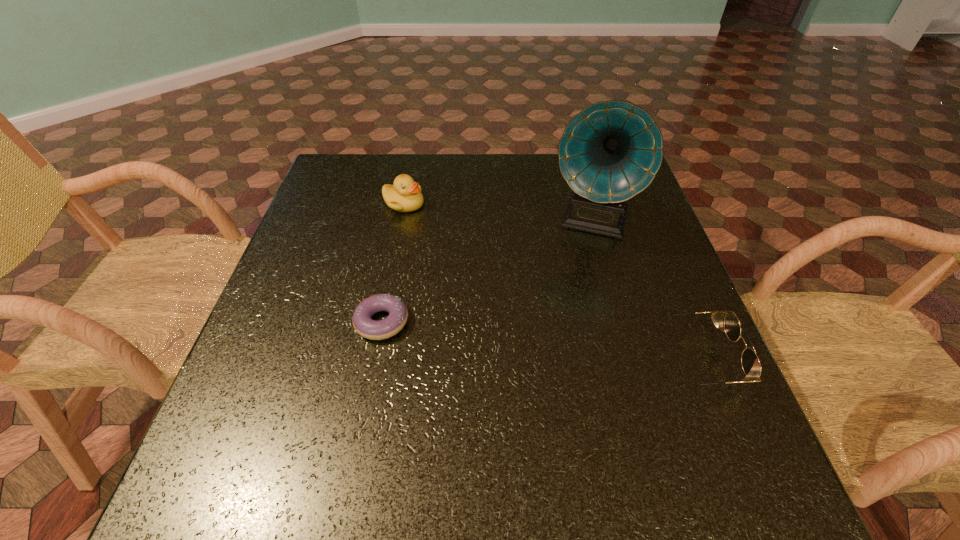
I want to click on vacant space located from the horn of the tallest object, so click(556, 358).

Where is `duckling that is at the far edge`? The image size is (960, 540). duckling that is at the far edge is located at coordinates (405, 195).

The height and width of the screenshot is (540, 960). In order to click on phonograph_record that is at the far edge in this screenshot , I will do click(x=611, y=151).

Locate an element on the screen. The height and width of the screenshot is (540, 960). object present at the near edge is located at coordinates (750, 362).

I want to click on sunglasses present at the right edge, so click(750, 362).

Find the location of a particular element. The image size is (960, 540). phonograph_record that is at the right edge is located at coordinates (611, 151).

Where is `object located at the far right corner`? The width and height of the screenshot is (960, 540). object located at the far right corner is located at coordinates (611, 151).

Identify the location of object that is positioned at the near right corner. The image size is (960, 540). (750, 362).

At what (x,y) coordinates should I click in order to perform the action: click on vacant space at the far edge of the desktop. Please return your answer as a coordinate pair (x, y). Looking at the image, I should click on (453, 154).

What are the coordinates of `vacant position at the near edge of the desktop` in the screenshot? It's located at (570, 432).